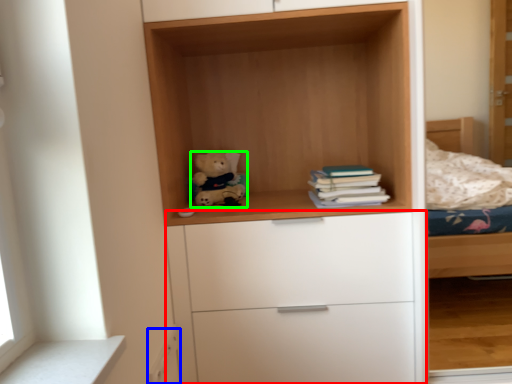
Question: Which object is positioned farthest from chest of drawers (highlighted by a red box)? Select from drawer (highlighted by a blue box) and teddy bear (highlighted by a green box).

Choices:
 (A) drawer
 (B) teddy bear

Answer: (B)